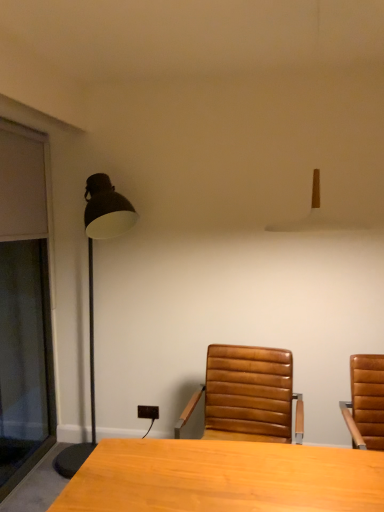
Question: Is white matte lampshade at upper center, the 1th lamp viewed from the front, beside leather at center?

Choices:
 (A) yes
 (B) no

Answer: (B)

Question: Is white matte lampshade at upper center, the 2th lamp in the back-to-front sequence, turned away from leather at center?

Choices:
 (A) no
 (B) yes

Answer: (A)

Question: Can you confirm if white matte lampshade at upper center, acting as the second lamp starting from the left, is thinner than leather at center?

Choices:
 (A) yes
 (B) no

Answer: (A)

Question: Is white matte lampshade at upper center, acting as the second lamp starting from the left, to the left of leather at center from the viewer's perspective?

Choices:
 (A) no
 (B) yes

Answer: (A)

Question: From the image's perspective, is white matte lampshade at upper center, which ranks as the first lamp in right-to-left order, over leather at center?

Choices:
 (A) no
 (B) yes

Answer: (B)

Question: Is white matte lampshade at upper center, the 1th lamp viewed from the front, facing towards leather at center?

Choices:
 (A) yes
 (B) no

Answer: (B)

Question: From the image's perspective, would you say leather at center is positioned over white matte lampshade at upper center, which ranks as the first lamp in right-to-left order?

Choices:
 (A) no
 (B) yes

Answer: (A)

Question: Is leather at center to the left of white matte lampshade at upper center, the 2th lamp in the back-to-front sequence, from the viewer's perspective?

Choices:
 (A) yes
 (B) no

Answer: (A)

Question: Is leather at center next to white matte lampshade at upper center, the 2th lamp in the back-to-front sequence, and touching it?

Choices:
 (A) no
 (B) yes

Answer: (A)

Question: Is leather at center facing away from white matte lampshade at upper center, the 1th lamp viewed from the front?

Choices:
 (A) no
 (B) yes

Answer: (A)

Question: Does leather at center have a lesser width compared to white matte lampshade at upper center, which ranks as the first lamp in right-to-left order?

Choices:
 (A) yes
 (B) no

Answer: (B)

Question: Does leather at center have a greater width compared to white matte lampshade at upper center, acting as the second lamp starting from the left?

Choices:
 (A) no
 (B) yes

Answer: (B)

Question: Would you consider leather at center to be distant from transparent glass screen door at left?

Choices:
 (A) no
 (B) yes

Answer: (B)